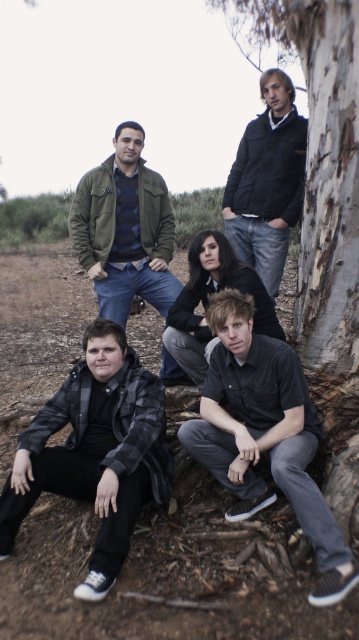
Can you confirm if leather jacket at lower left is shorter than dark blue jacket at center?

Yes.

Who is higher up, leather jacket at lower left or dark blue jacket at center?

Positioned higher is dark blue jacket at center.

Who is more distant from viewer, (x=86, y=396) or (x=234, y=237)?

Point (x=234, y=237)

Where is `leather jacket at lower left`? leather jacket at lower left is located at coordinates (95, 451).

Does dirt ground at center have a larger size compared to matte green jacket at upper left?

Correct, dirt ground at center is larger in size than matte green jacket at upper left.

Is dirt ground at center taller than matte green jacket at upper left?

Yes, dirt ground at center is taller than matte green jacket at upper left.

Between point (290, 625) and point (160, 307), which one is positioned in front?

Point (290, 625) is more forward.

The image size is (359, 640). Find the location of `dirt ground at center`. dirt ground at center is located at coordinates (168, 570).

What do you see at coordinates (168, 570) in the screenshot? The width and height of the screenshot is (359, 640). I see `dirt ground at center` at bounding box center [168, 570].

Which is in front, point (34, 312) or point (207, 285)?

Point (207, 285) is more forward.

Is point (6, 451) positioned before point (188, 285)?

Yes, it is.

You are a GUI agent. You are given a task and a screenshot of the screen. Output one action in this format:
    pyautogui.click(x=<x>, y=<y>)
    Task: Click on the dirt ground at center
    
    Given the screenshot: What is the action you would take?
    click(x=168, y=570)